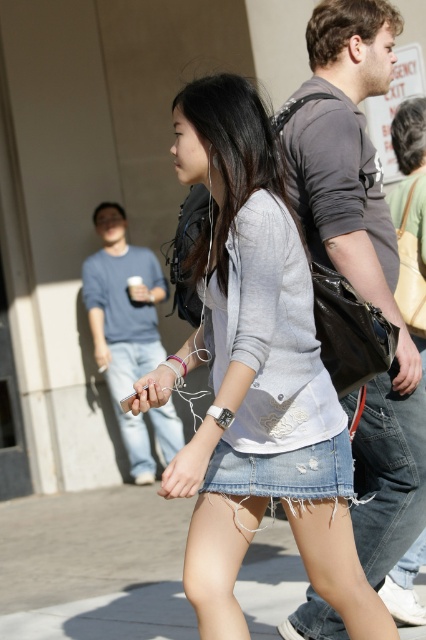
Question: Which of the following is the closest to the observer?

Choices:
 (A) (284, 189)
 (B) (146, 508)

Answer: (A)

Question: Can you confirm if dark gray fabric backpack at center is wider than blue denim jeans at lower left?

Choices:
 (A) no
 (B) yes

Answer: (A)

Question: Which of these objects is positioned closest to the blue denim jeans at lower left?

Choices:
 (A) denim skirt at lower center
 (B) dark gray fabric backpack at center
 (C) denim skirt at center

Answer: (A)

Question: Can you confirm if denim skirt at center is positioned to the left of blue denim jeans at lower left?

Choices:
 (A) no
 (B) yes

Answer: (A)

Question: Can you confirm if denim skirt at center is positioned to the right of denim skirt at lower center?

Choices:
 (A) yes
 (B) no

Answer: (A)

Question: Which object is positioned farthest from the blue denim jeans at lower left?

Choices:
 (A) denim skirt at lower center
 (B) dark gray fabric backpack at center

Answer: (B)